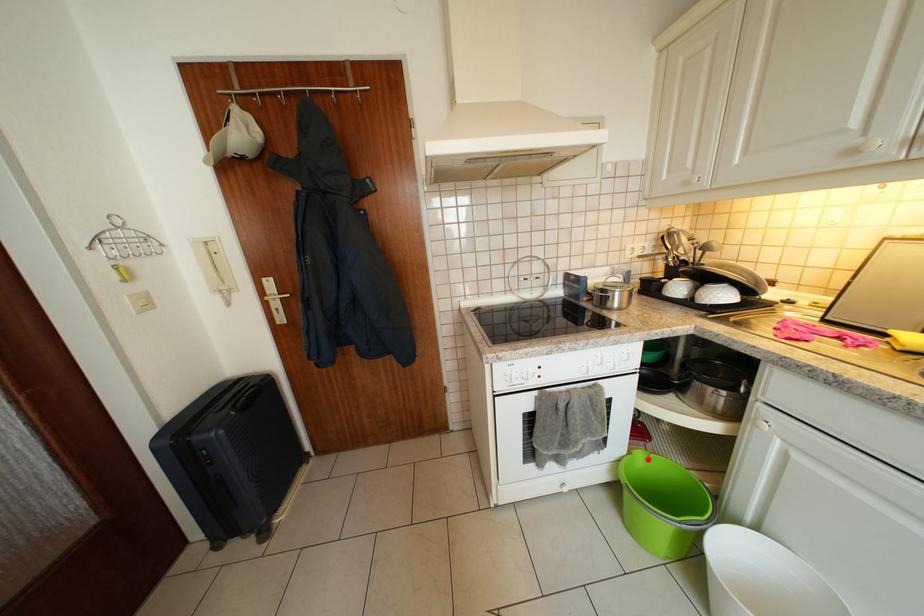
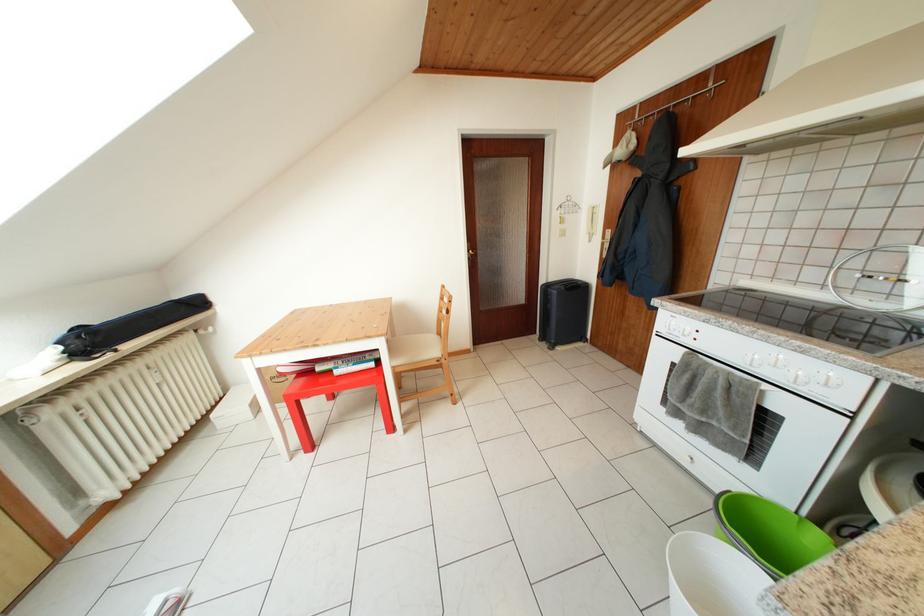
The point at the highlighted location is marked in the first image. Where is the corresponding point in the second image?

(828, 540)